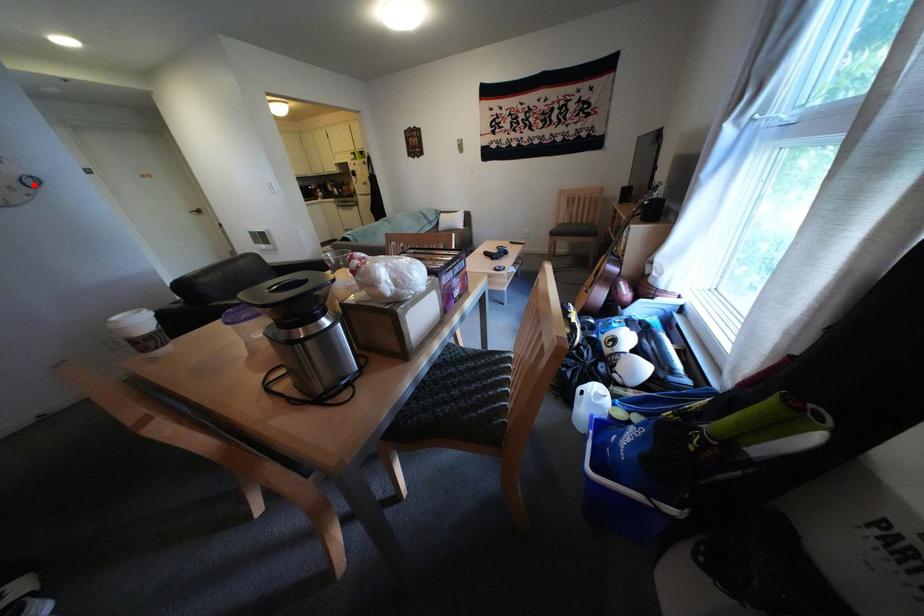
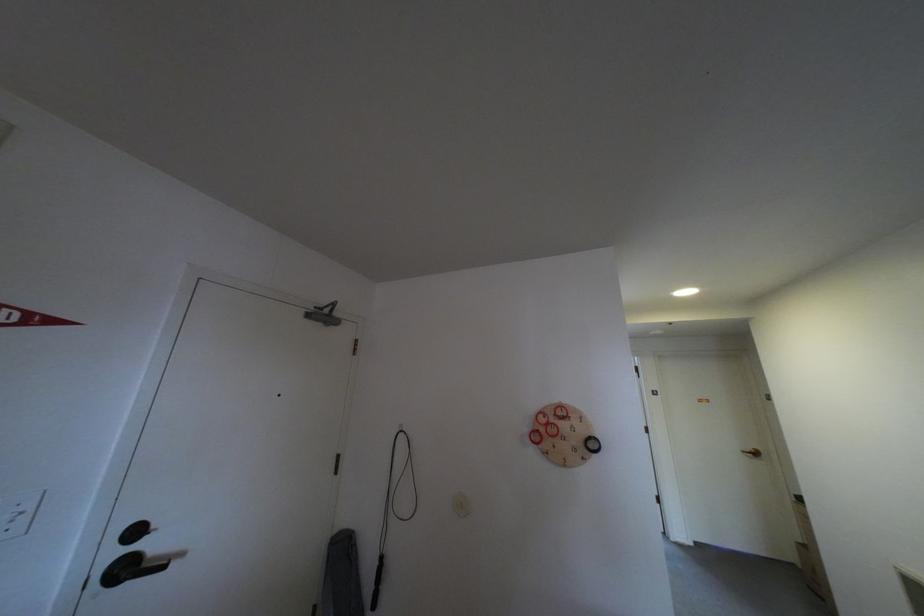
The point at the highlighted location is marked in the first image. Where is the corresponding point in the second image?

(597, 446)